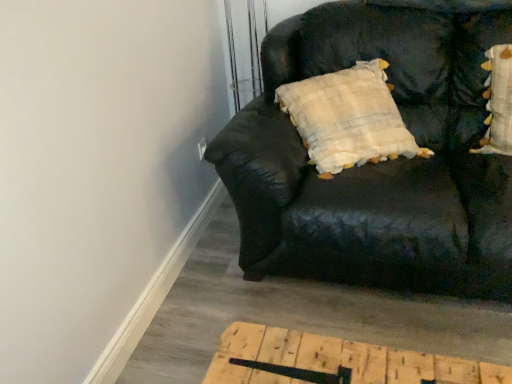
Question: Which direction should I rotate to look at fluffy white pillow with yellow accents at upper right?

Choices:
 (A) right
 (B) left

Answer: (A)

Question: Is black leather couch at upper right shorter than fluffy white pillow with yellow accents at upper right?

Choices:
 (A) no
 (B) yes

Answer: (A)

Question: Can you confirm if black leather couch at upper right is wider than fluffy white pillow with yellow accents at upper right?

Choices:
 (A) yes
 (B) no

Answer: (A)

Question: Can you confirm if black leather couch at upper right is smaller than fluffy white pillow with yellow accents at upper right?

Choices:
 (A) yes
 (B) no

Answer: (B)

Question: Are black leather couch at upper right and fluffy white pillow with yellow accents at upper right far apart?

Choices:
 (A) yes
 (B) no

Answer: (B)

Question: Can we say black leather couch at upper right lies outside fluffy white pillow with yellow accents at upper right?

Choices:
 (A) no
 (B) yes

Answer: (B)

Question: Considering the relative positions of black leather couch at upper right and fluffy white pillow with yellow accents at upper right in the image provided, is black leather couch at upper right to the right of fluffy white pillow with yellow accents at upper right from the viewer's perspective?

Choices:
 (A) no
 (B) yes

Answer: (A)

Question: From the image's perspective, is fluffy white pillow with yellow accents at upper right below black leather couch at upper right?

Choices:
 (A) no
 (B) yes

Answer: (A)

Question: Does fluffy white pillow with yellow accents at upper right come in front of black leather couch at upper right?

Choices:
 (A) yes
 (B) no

Answer: (B)

Question: Is fluffy white pillow with yellow accents at upper right far away from black leather couch at upper right?

Choices:
 (A) yes
 (B) no

Answer: (B)

Question: From a real-world perspective, is fluffy white pillow with yellow accents at upper right located higher than black leather couch at upper right?

Choices:
 (A) yes
 (B) no

Answer: (A)

Question: Does fluffy white pillow with yellow accents at upper right have a greater width compared to black leather couch at upper right?

Choices:
 (A) yes
 (B) no

Answer: (B)

Question: Is fluffy white pillow with yellow accents at upper right facing towards black leather couch at upper right?

Choices:
 (A) no
 (B) yes

Answer: (B)

Question: Does point (285, 228) appear closer or farther from the camera than point (500, 66)?

Choices:
 (A) closer
 (B) farther

Answer: (A)